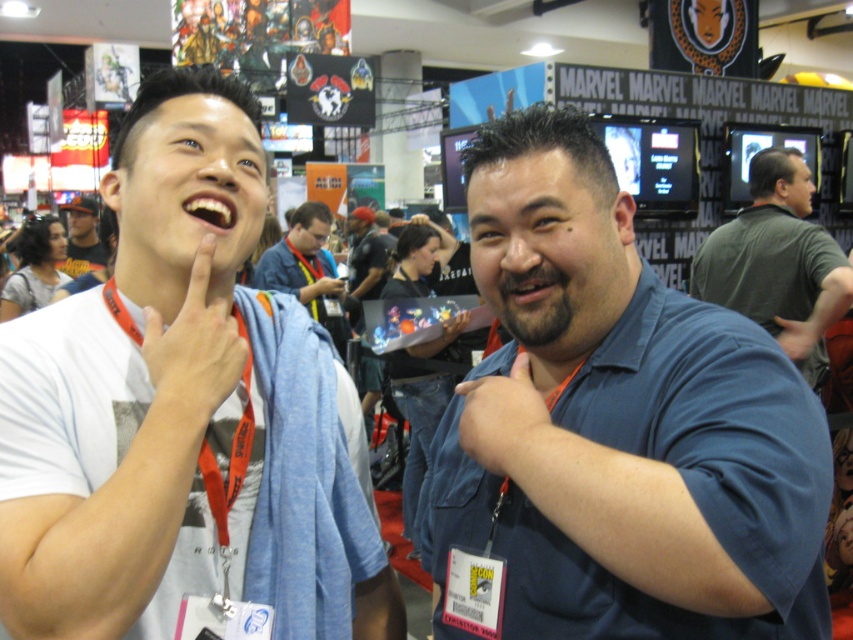
You are attending a Marvel convention and notice two items in the image. The first is a blue cotton shirt at center, and the second is a matte orange lanyard at upper left. Which of these two items is taller?

The blue cotton shirt at center is taller than the matte orange lanyard at upper left according to the description.

In the scene shown: You are an event organizer at the MARVEL expo and need to ensure that all attendees have their lanyards visible for security. Given that the matte orange lanyard at upper left and the matte black hand at lower right are both in the frame, which object takes up more space in the image?

The matte black hand at lower right takes up more space than the matte orange lanyard at upper left.